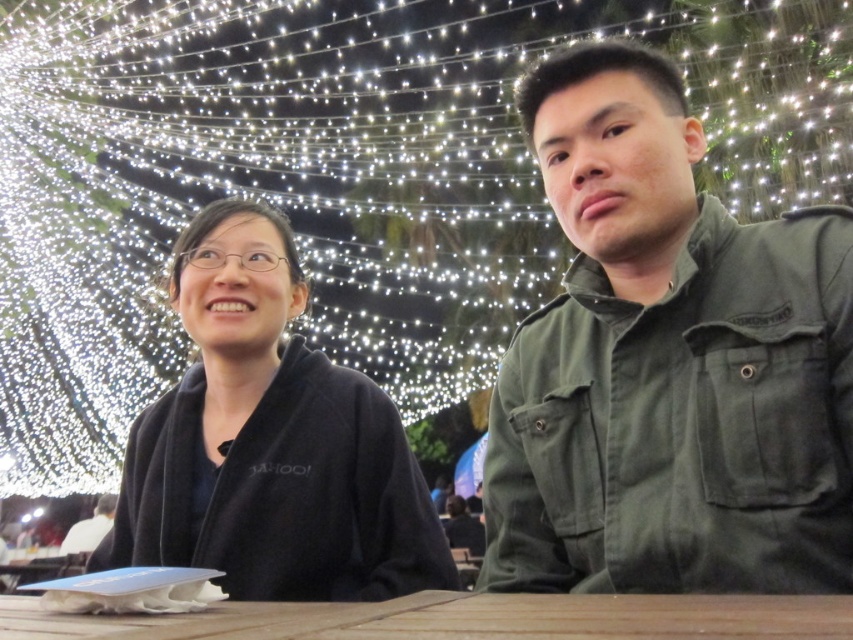
You are organizing a clothing donation drive and need to categorize jackets based on their sizes. Given that the green matte jacket at right and the black fleece jacket at left are both present, which one should you place in the small size bin?

The green matte jacket at right should be placed in the small size bin because it has a smaller size compared to the black fleece jacket at left.

You are standing at the point marked by the coordinate point at (750, 428). You want to throw a small ball to your friend who is sitting 7.55 feet away from you. Is the distance between you and your friend sufficient to make a successful throw without it going too far?

The distance between you and your friend is 7.55 feet, so yes, the throw can be successful as the distance is manageable for a small ball toss.